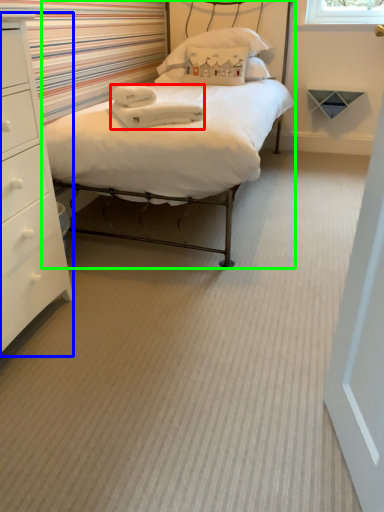
Question: Estimate the real-world distances between objects in this image. Which object is closer to material (highlighted by a red box), chest of drawers (highlighted by a blue box) or bed (highlighted by a green box)?

Choices:
 (A) chest of drawers
 (B) bed

Answer: (B)